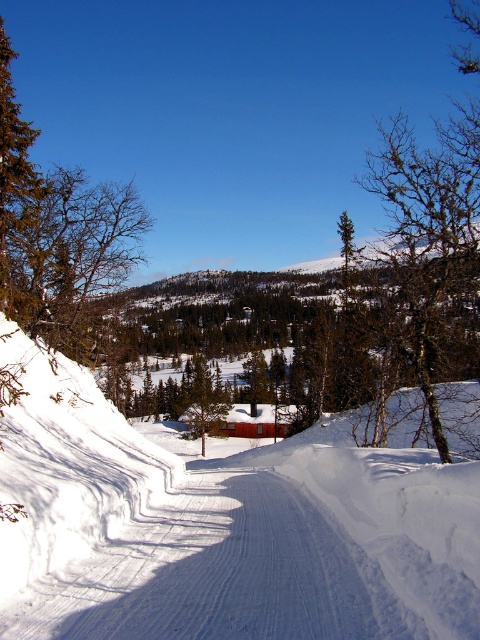
Is brown/dry wood tree at left below green coniferous tree at left?

No.

Image resolution: width=480 pixels, height=640 pixels. What do you see at coordinates (69, 253) in the screenshot?
I see `brown/dry wood tree at left` at bounding box center [69, 253].

Which is in front, point (104, 262) or point (20, 145)?

Point (20, 145) is in front.

Locate an element on the screen. Image resolution: width=480 pixels, height=640 pixels. brown/dry wood tree at left is located at coordinates click(x=69, y=253).

Does point (410, 332) come farther from viewer compared to point (12, 212)?

No, (410, 332) is closer to viewer.

Is brown/dry wood tree at right positioned before brown/dry wood tree at left?

Yes, brown/dry wood tree at right is in front of brown/dry wood tree at left.

Identify the location of brown/dry wood tree at right. (433, 248).

The width and height of the screenshot is (480, 640). Find the location of `brown/dry wood tree at right`. brown/dry wood tree at right is located at coordinates (433, 248).

Which is more to the right, brown/dry wood tree at right or green coniferous tree at left?

Positioned to the right is brown/dry wood tree at right.

Between brown/dry wood tree at right and green coniferous tree at left, which one is positioned lower?

green coniferous tree at left is lower down.

Which is in front, point (397, 148) or point (14, 186)?

Point (14, 186) is more forward.

Identify the location of brown/dry wood tree at right. (433, 248).